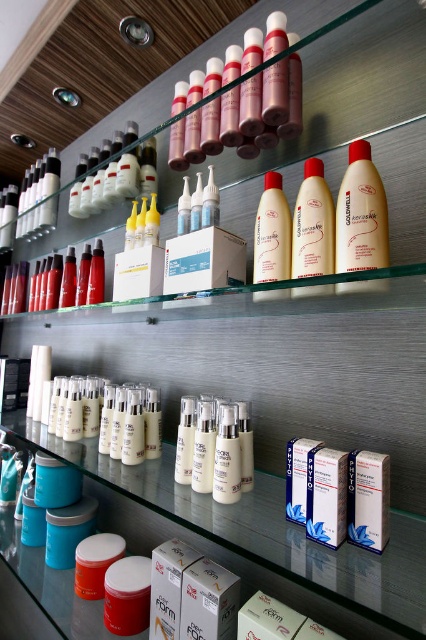
You are a customer in the salon and want to pick up the product located at point (282, 266). The product is 63.49 centimeters away from you. Can you reach it without moving closer?

The point (282, 266) is 63.49 centimeters away from you. Since the distance is within a typical reaching range, you can likely reach it without moving closer.

You are a customer in a beauty store and want to place a small hand sanitizer bottle between the translucent amber bottle at center and the white matte tube at center. The hand sanitizer is 3 inches long. Is there enough space between them to fit the hand sanitizer?

The distance between the translucent amber bottle at center and the white matte tube at center is 9.59 inches. Since the hand sanitizer is only 3 inches long, there is sufficient space to place it between them.

What are the coordinates of the translucent amber bottle at center?

The translucent amber bottle at center is located at coordinates point (360, 214).